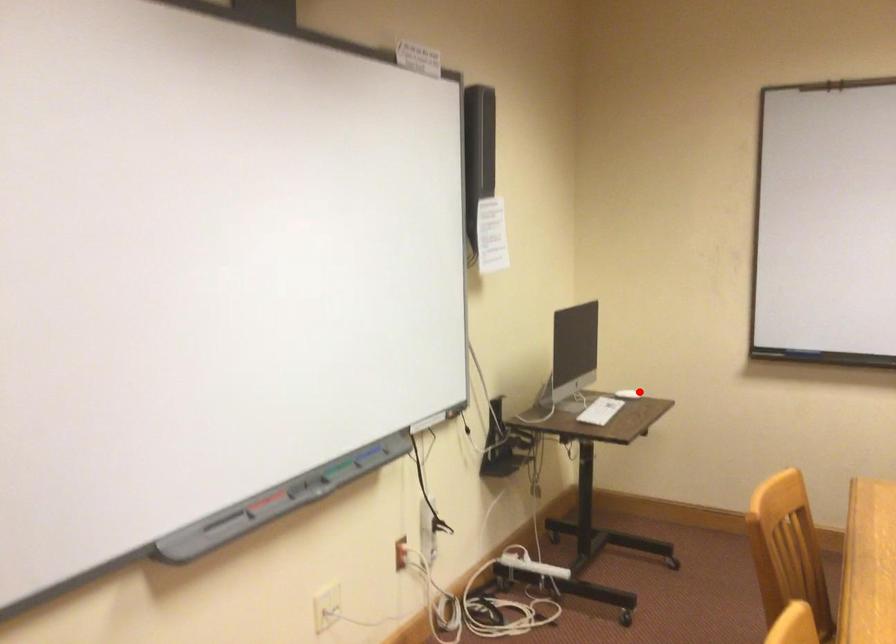
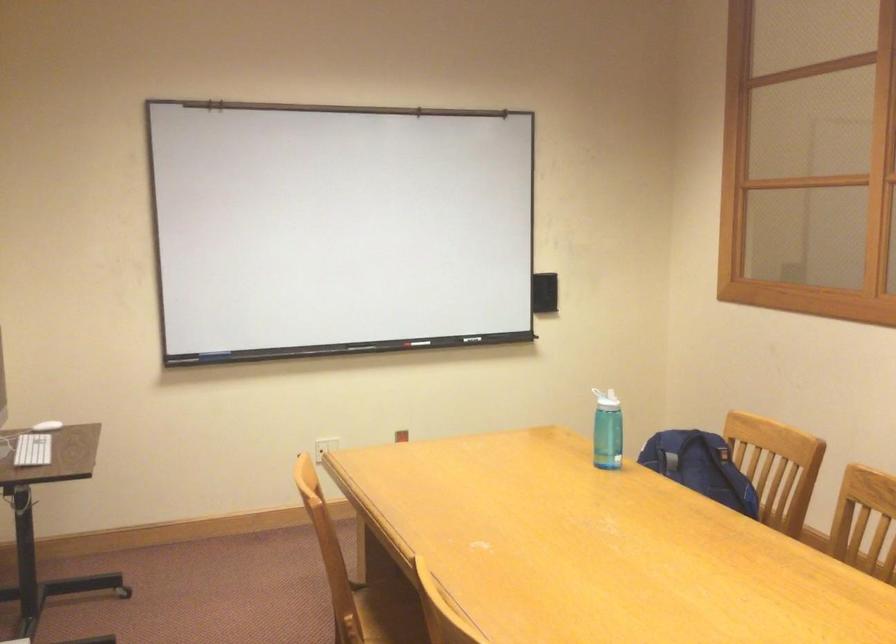
Locate, in the second image, the point that corresponds to the highlighted location in the first image.

(47, 426)